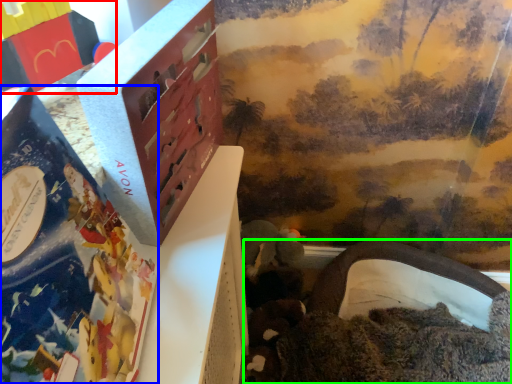
Question: Which object is the farthest from toy (highlighted by a red box)? Choose among these: book (highlighted by a blue box) or toy (highlighted by a green box).

Choices:
 (A) book
 (B) toy

Answer: (B)